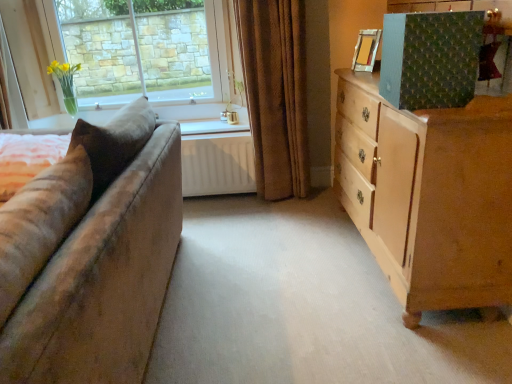
Image resolution: width=512 pixels, height=384 pixels. What are the coordinates of `free space in front of white matte radiator at center` in the screenshot? It's located at 224,215.